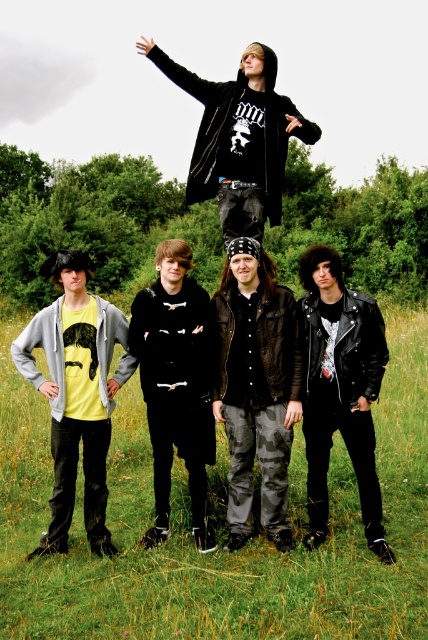
Does green grass at lower center have a greater width compared to camouflage pants at center?

Yes.

Looking at this image, does green grass at lower center appear under camouflage pants at center?

Correct, green grass at lower center is located below camouflage pants at center.

What do you see at coordinates (216, 531) in the screenshot? Image resolution: width=428 pixels, height=640 pixels. I see `green grass at lower center` at bounding box center [216, 531].

Identify the location of green grass at lower center. (216, 531).

From the picture: Is green grass at lower center below black leather jacket at upper center?

Correct, green grass at lower center is located below black leather jacket at upper center.

Can you confirm if green grass at lower center is positioned to the right of black leather jacket at upper center?

In fact, green grass at lower center is to the left of black leather jacket at upper center.

Measure the distance between green grass at lower center and camera.

green grass at lower center and camera are 3.88 meters apart.

Locate an element on the screen. green grass at lower center is located at coordinates pyautogui.click(x=216, y=531).

In the scene shown: Does green grass at lower center have a greater height compared to black leather jacket at center?

Incorrect, green grass at lower center's height is not larger of black leather jacket at center's.

Is green grass at lower center in front of black leather jacket at center?

Yes, it is in front of black leather jacket at center.

At what (x,y) coordinates should I click in order to perform the action: click on green grass at lower center. Please return your answer as a coordinate pair (x, y). Looking at the image, I should click on (216, 531).